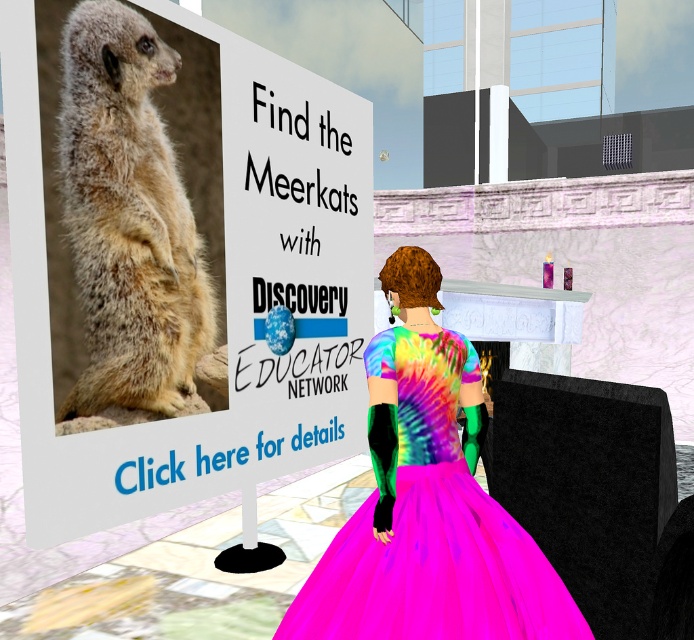
Looking at this image, you are a character in a virtual environment and you see a natural fur meerkat at upper left and a light brown fur meerkat at center. Which meerkat is taller?

The natural fur meerkat at upper left is much taller than the light brown fur meerkat at center.